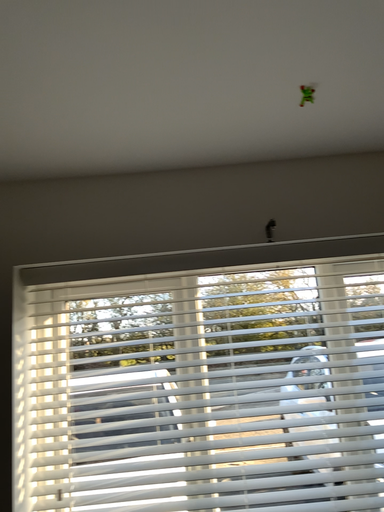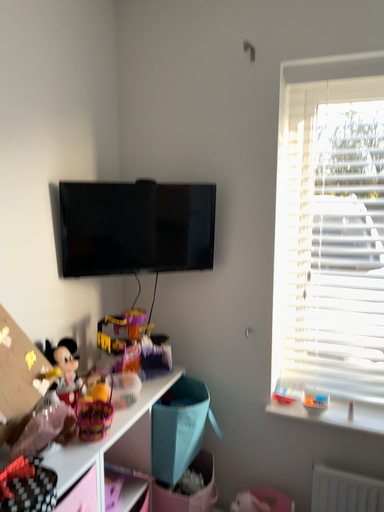
Question: Which way did the camera rotate in the video?

Choices:
 (A) rotated left
 (B) rotated right

Answer: (A)